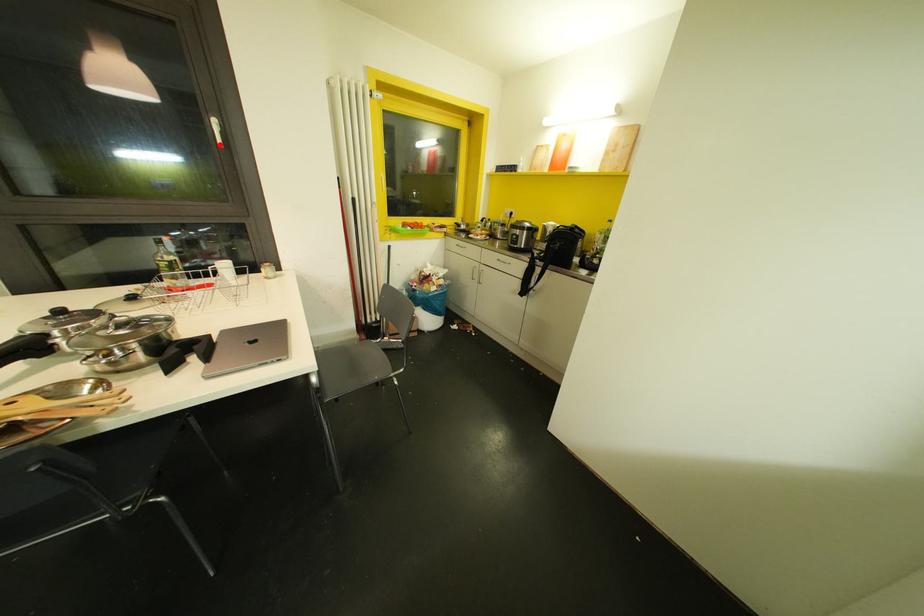
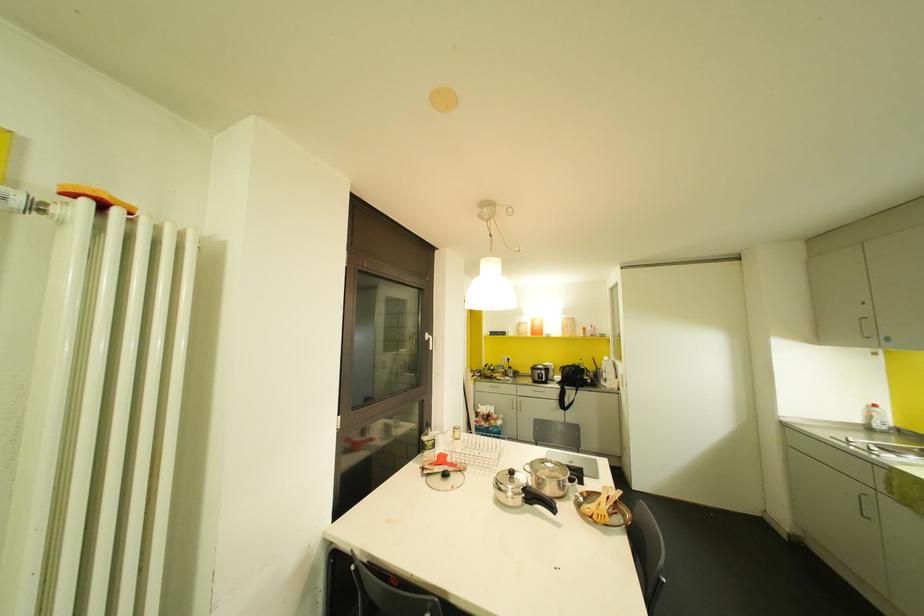
The point at the highlighted location is marked in the first image. Where is the corresponding point in the second image?

(430, 347)